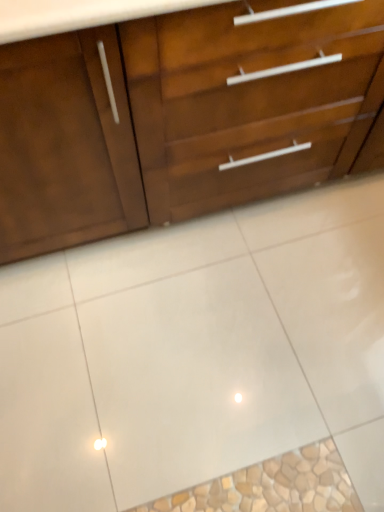
The width and height of the screenshot is (384, 512). In order to click on vacant area on top of white glossy tile at center (from a real-world perspective) in this screenshot , I will do `click(231, 352)`.